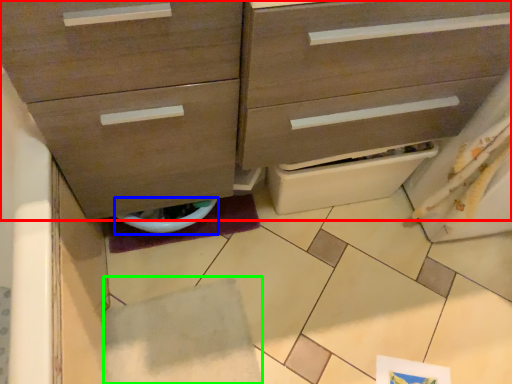
Question: Which is nearer to the chest of drawers (highlighted by a red box)? toilet bowl (highlighted by a blue box) or tile (highlighted by a green box).

Choices:
 (A) toilet bowl
 (B) tile

Answer: (A)